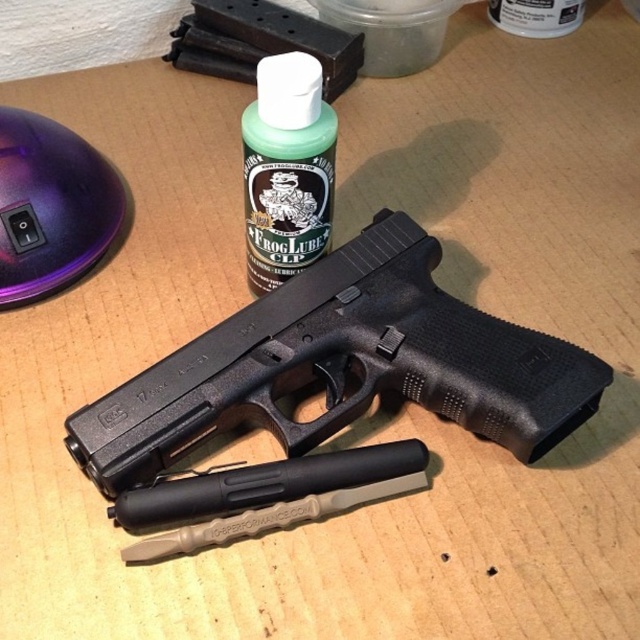
Question: Considering the relative positions of purple glossy mouse at upper left and green matte bottle at center in the image provided, where is purple glossy mouse at upper left located with respect to green matte bottle at center?

Choices:
 (A) left
 (B) right

Answer: (A)

Question: Can you confirm if black matte handgun at center is positioned below green matte bottle at center?

Choices:
 (A) no
 (B) yes

Answer: (B)

Question: Is black matte handgun at center in front of green matte bottle at center?

Choices:
 (A) no
 (B) yes

Answer: (B)

Question: Which object appears closest to the camera in this image?

Choices:
 (A) green matte bottle at center
 (B) purple glossy mouse at upper left
 (C) black matte handgun at center

Answer: (C)

Question: Which point appears farthest from the camera in this image?

Choices:
 (A) (58, 170)
 (B) (365, 304)

Answer: (A)

Question: Among these objects, which one is nearest to the camera?

Choices:
 (A) black matte handgun at center
 (B) purple glossy mouse at upper left
 (C) green matte bottle at center

Answer: (A)